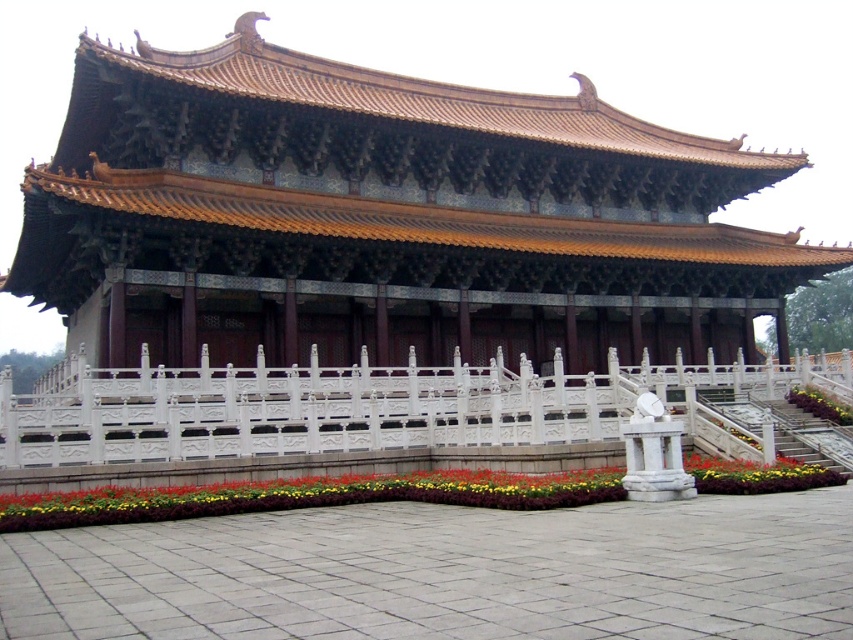
Question: Where is golden glazed tile roof at center located in relation to floral carpet at center in the image?

Choices:
 (A) above
 (B) below

Answer: (A)

Question: Does white stone railing at center appear on the right side of floral carpet at center?

Choices:
 (A) no
 (B) yes

Answer: (B)

Question: Which object is closer to the camera taking this photo?

Choices:
 (A) golden glazed tile roof at center
 (B) white stone railing at center

Answer: (B)

Question: Can you confirm if golden glazed tile roof at center is wider than floral carpet at center?

Choices:
 (A) no
 (B) yes

Answer: (B)

Question: Which object appears closest to the camera in this image?

Choices:
 (A) floral carpet at center
 (B) golden glazed tile roof at center
 (C) white stone railing at center

Answer: (A)

Question: Which of the following is the closest to the observer?

Choices:
 (A) (88, 500)
 (B) (550, 394)
 (C) (352, 115)

Answer: (A)